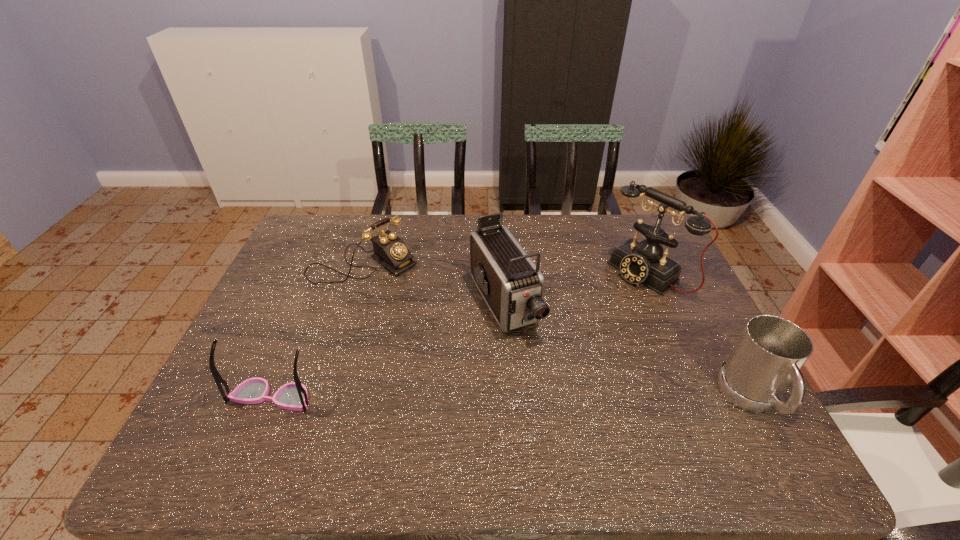
Locate an element on the screen. vacant space on the desktop that is between the spectacles and the mug and is positioned on the dial of the shorter telephone is located at coordinates (530, 398).

Locate an element on the screen. The image size is (960, 540). free space on the desktop that is between the spectacles and the mug and is positioned at the lens of the third object from left to right is located at coordinates 564,399.

You are a GUI agent. You are given a task and a screenshot of the screen. Output one action in this format:
    pyautogui.click(x=<x>, y=<y>)
    Task: Click on the vacant space on the desktop that is between the spectacles and the mug and is positioned on the dial of the right telephone
    Image resolution: width=960 pixels, height=540 pixels.
    Given the screenshot: What is the action you would take?
    click(476, 398)